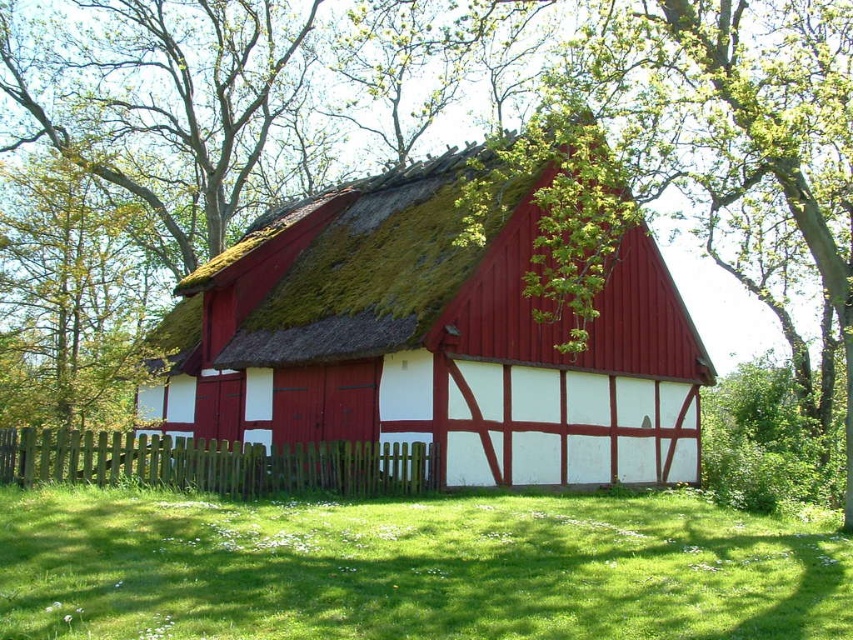
You are a gardener who wants to plant a row of flowers between the matte red wood cottage at center and the green grass at lower center. The row requires a minimum of 30 feet of space. Can you determine if there is enough space between them to plant the flowers?

The matte red wood cottage at center and green grass at lower center are 33.60 feet apart, which exceeds the required 30 feet. Therefore, there is sufficient space to plant the row of flowers between them.

You are standing in front of the traditional half timbered house and want to walk towards the green wooden fence at lower center. Which direction should you walk to avoid stepping on the green grass at lower center?

The green grass at lower center is wider than the green wooden fence at lower center, so you should walk to the left or right of the green wooden fence at lower center to avoid stepping on the green grass at lower center.